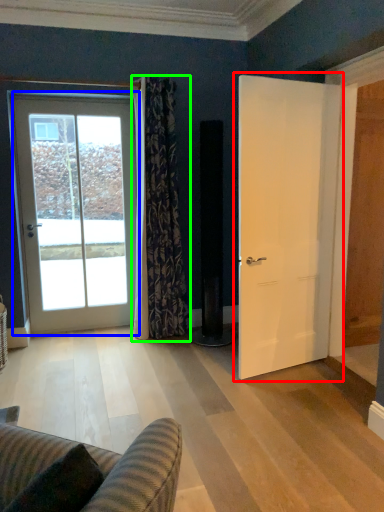
Question: Considering the real-world distances, which object is farthest from door (highlighted by a red box)? door (highlighted by a blue box) or curtain (highlighted by a green box)?

Choices:
 (A) door
 (B) curtain

Answer: (A)